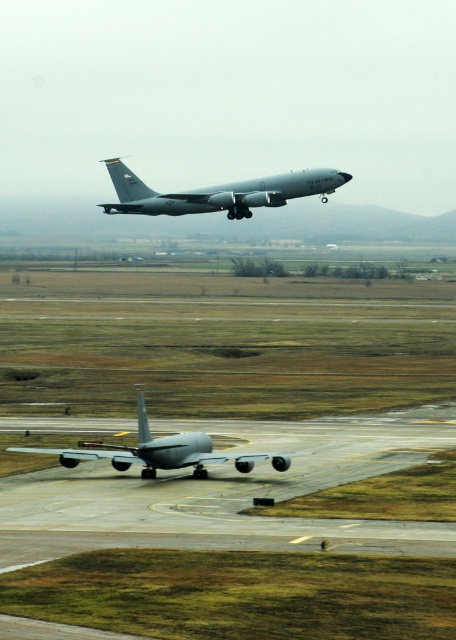
You are a ground crew member at the airport and need to ensure that the two matte gray airplanes are at least 30 meters apart for safety protocols. Based on the image, are the matte gray airplane at upper center and the matte gray airplane at lower center meeting this requirement?

The matte gray airplane at upper center and the matte gray airplane at lower center are 28.01 meters apart from each other, which is less than the required 30 meters. Therefore, they are not meeting the safety requirement.

You are a ground crew member at the airport and need to direct the matte gray airplane at upper center to a maintenance hangar located at coordinates 0.5, 0.6. Based on its current position at 0.302, 0.482, in which general direction should you guide it to reach the hangar?

The matte gray airplane at upper center is currently at position (x=219, y=193) and needs to reach the maintenance hangar at (x=273, y=320). To reach the hangar, the airplane should move northeast since the hangar is northeast of its current position.